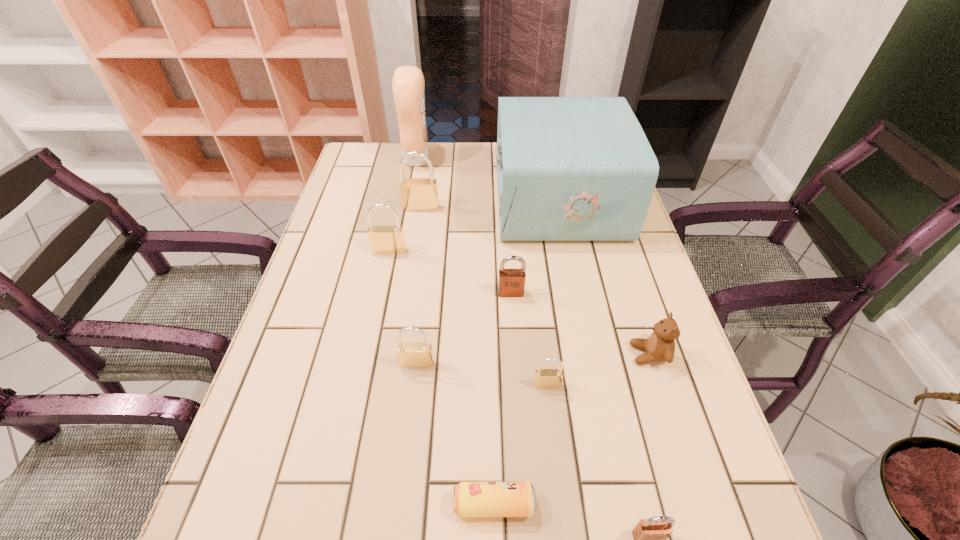
Identify the location of object positioned at the left edge. (383, 239).

This screenshot has width=960, height=540. I want to click on radio receiver that is at the right edge, so click(568, 168).

This screenshot has height=540, width=960. I want to click on teddy bear located in the right edge section of the desktop, so click(x=660, y=346).

Where is `object that is at the far right corner`? The width and height of the screenshot is (960, 540). object that is at the far right corner is located at coordinates (568, 168).

In the image, there is a desktop. Where is `vacant area at the far edge`? vacant area at the far edge is located at coordinates (416, 171).

Identify the location of vacant space at the left edge of the desktop. The image size is (960, 540). (361, 308).

The width and height of the screenshot is (960, 540). I want to click on free space at the right edge, so click(687, 502).

The image size is (960, 540). Identify the location of free location at the far left corner of the desktop. tap(367, 145).

Find the location of a particular element. vacant space in between the second smallest brass padlock and the tallest object is located at coordinates click(417, 262).

You are a GUI agent. You are given a task and a screenshot of the screen. Output one action in this format:
    pyautogui.click(x=<x>, y=<y>)
    Task: Click on the vacant point located between the farthest brass padlock and the radio receiver
    
    Given the screenshot: What is the action you would take?
    pyautogui.click(x=490, y=204)